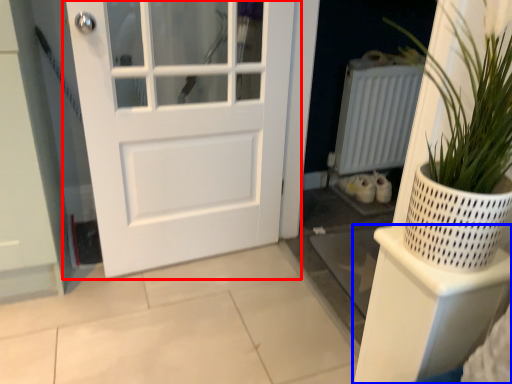
Question: Which object is further to the camera taking this photo, door (highlighted by a red box) or shelf (highlighted by a blue box)?

Choices:
 (A) door
 (B) shelf

Answer: (A)